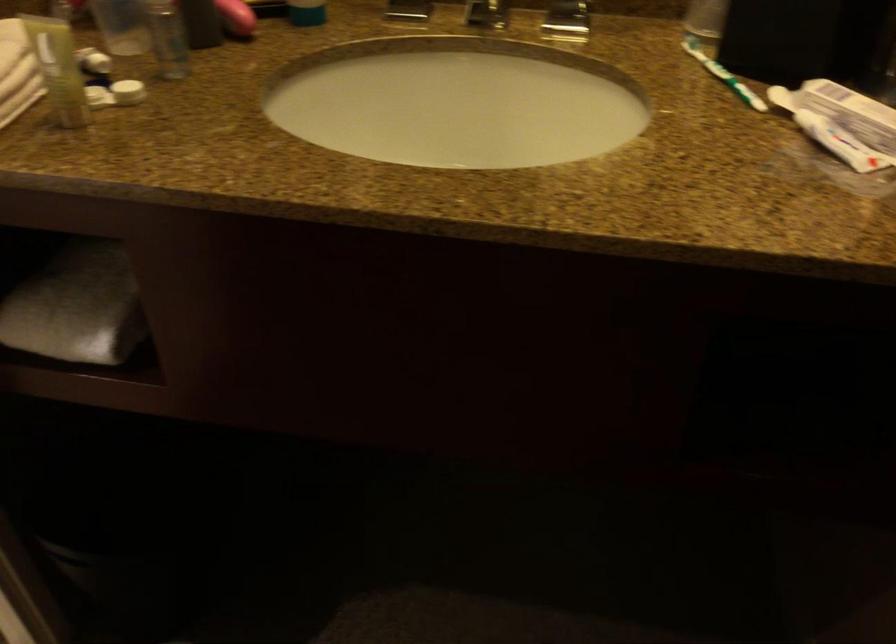
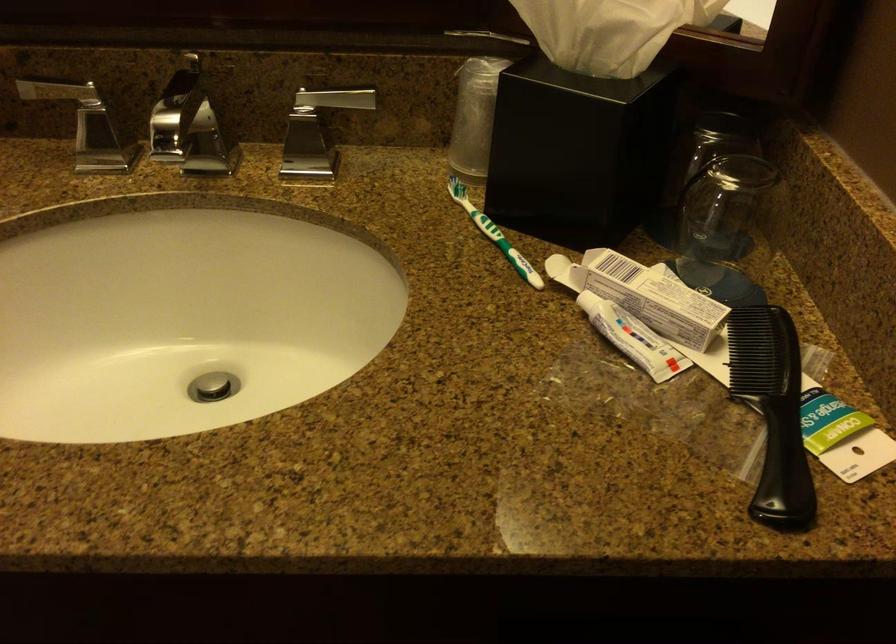
Find the pixel in the second image that matches point (725, 75) in the first image.

(494, 234)